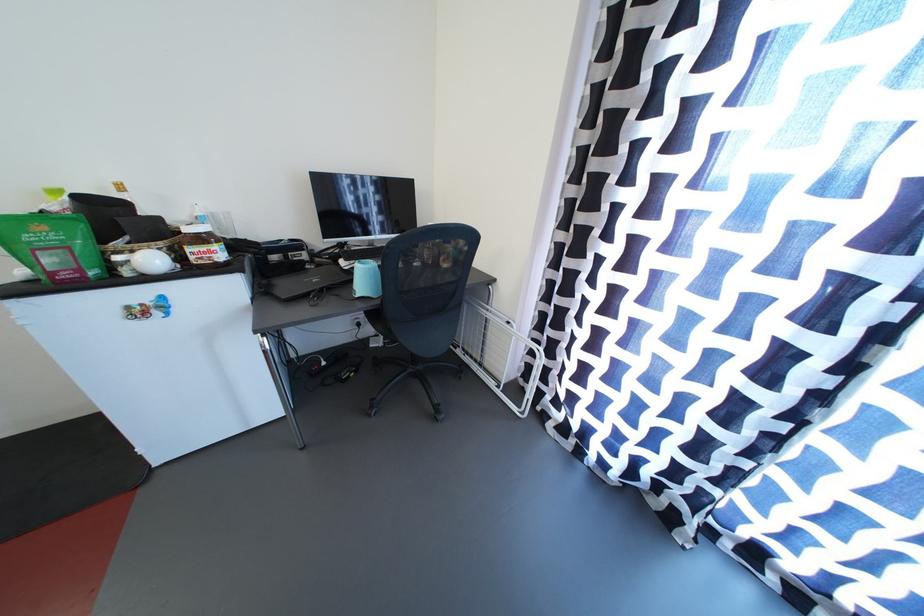
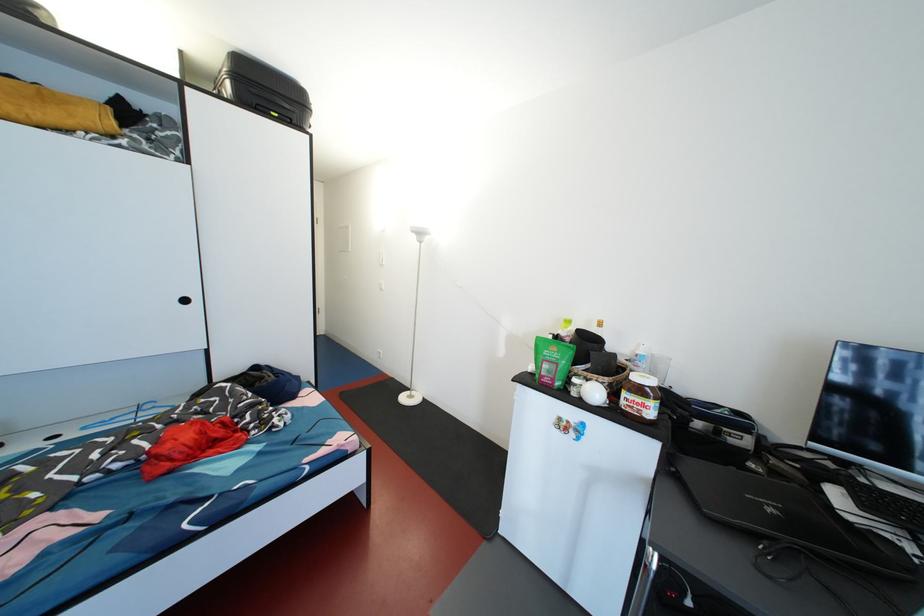
Where in the second image is the point corresponding to point 268,297 from the first image?

(675, 474)